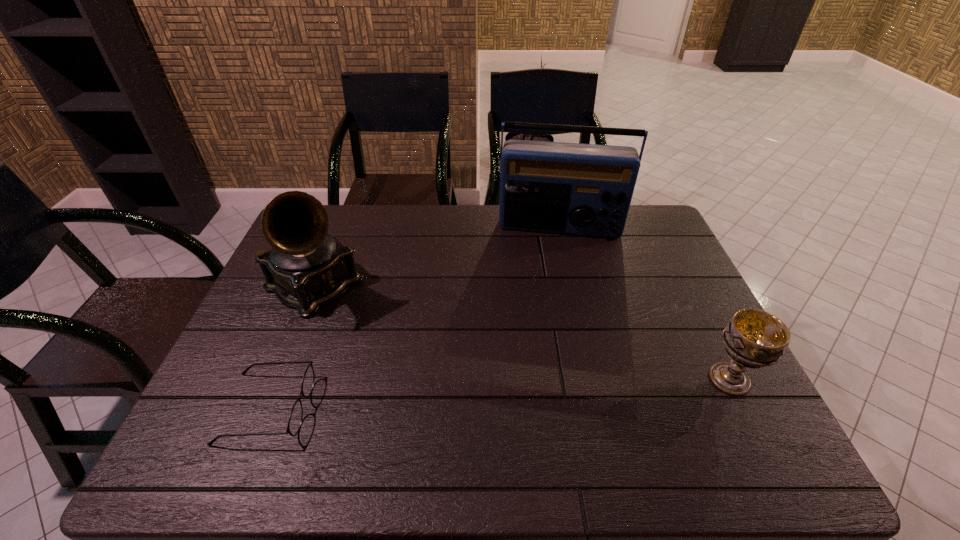
Identify the location of vacant region located 0.400m on the horn of the phonograph record. The width and height of the screenshot is (960, 540). (455, 385).

Locate an element on the screen. The width and height of the screenshot is (960, 540). vacant area situated on the front panel of the farthest object is located at coordinates (552, 303).

Identify the location of blank space located on the front panel of the farthest object. (553, 280).

At what (x,y) coordinates should I click in order to perform the action: click on free point located 0.280m on the front panel of the farthest object. Please return your answer as a coordinate pair (x, y). The image size is (960, 540). Looking at the image, I should click on pos(552,303).

The image size is (960, 540). Find the location of `object present at the far edge`. object present at the far edge is located at coordinates (554, 187).

At what (x,y) coordinates should I click in order to perform the action: click on spectacles located at the near edge. Please return your answer as a coordinate pair (x, y). This screenshot has height=540, width=960. Looking at the image, I should click on (295, 419).

This screenshot has width=960, height=540. In order to click on chalice present at the near edge in this screenshot , I will do `click(753, 338)`.

Where is `spectacles located in the left edge section of the desktop`? The width and height of the screenshot is (960, 540). spectacles located in the left edge section of the desktop is located at coordinates (295, 419).

I want to click on phonograph record at the left edge, so click(x=307, y=268).

You are a GUI agent. You are given a task and a screenshot of the screen. Output one action in this format:
    pyautogui.click(x=<x>, y=<y>)
    Task: Click on the chalice present at the right edge
    The image size is (960, 540).
    Given the screenshot: What is the action you would take?
    pyautogui.click(x=753, y=338)